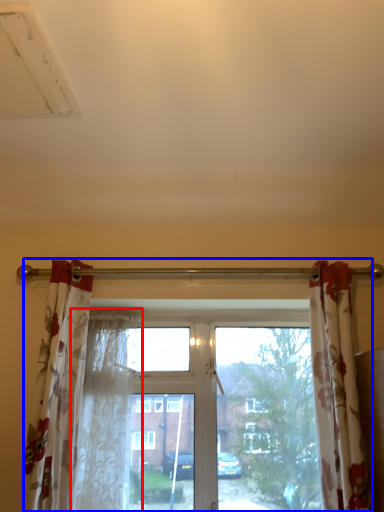
Question: Which point is further to the camera, shower curtain (highlighted by a red box) or window (highlighted by a blue box)?

Choices:
 (A) shower curtain
 (B) window

Answer: (B)